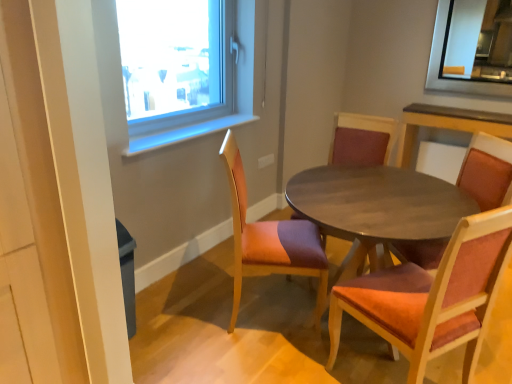
Describe the element at coordinates (361, 139) in the screenshot. The height and width of the screenshot is (384, 512). I see `wooden chair with red cushion at center, which appears as the 2th chair when viewed from the left` at that location.

What do you see at coordinates (270, 240) in the screenshot? This screenshot has width=512, height=384. I see `wooden textured chair at center, placed as the 4th chair when sorted from right to left` at bounding box center [270, 240].

What do you see at coordinates (371, 201) in the screenshot? Image resolution: width=512 pixels, height=384 pixels. I see `wooden table at center` at bounding box center [371, 201].

Where is `wooden chair with red cushion at center, placed as the third chair when sorted from right to left`? wooden chair with red cushion at center, placed as the third chair when sorted from right to left is located at coordinates (361, 139).

In terms of width, does wooden table at center look wider or thinner when compared to wooden textured chair at center, the 4th chair when ordered from left to right?

In the image, wooden table at center appears to be wider than wooden textured chair at center, the 4th chair when ordered from left to right.

The height and width of the screenshot is (384, 512). What are the coordinates of `kitchen & dining room table in front of the wooden textured chair at center, the 4th chair when ordered from left to right` in the screenshot? It's located at (371, 201).

Consider the image. From the image's perspective, is wooden table at center below wooden textured chair at center, the 4th chair when ordered from left to right?

Yes, from the image's perspective, wooden table at center is beneath wooden textured chair at center, the 4th chair when ordered from left to right.

Considering the relative sizes of wooden table at center and wooden textured chair at center, the 1th chair in the right-to-left sequence, in the image provided, is wooden table at center bigger than wooden textured chair at center, the 1th chair in the right-to-left sequence,?

Correct, wooden table at center is larger in size than wooden textured chair at center, the 1th chair in the right-to-left sequence.

Where is `the 3rd chair above the wooden table at center (from the image's perspective)`? This screenshot has width=512, height=384. the 3rd chair above the wooden table at center (from the image's perspective) is located at coordinates (361, 139).

Are wooden table at center and wooden chair with red cushion at center, placed as the third chair when sorted from right to left, making contact?

wooden table at center is not next to wooden chair with red cushion at center, placed as the third chair when sorted from right to left, and they're not touching.

Is wooden table at center wider than wooden chair with red cushion at center, placed as the third chair when sorted from right to left?

Yes, wooden table at center is wider than wooden chair with red cushion at center, placed as the third chair when sorted from right to left.

Between wooden table at center and wooden chair with red cushion at center, which appears as the 2th chair when viewed from the left, which one appears on the left side from the viewer's perspective?

wooden chair with red cushion at center, which appears as the 2th chair when viewed from the left.

What's the angular difference between velvet orange chair at center, the 3th chair positioned from the left, and wooden textured chair at center, the 1th chair in the right-to-left sequence,'s facing directions?

They differ by 72.6 degrees in their facing directions.

Considering the positions of objects velvet orange chair at center, the second chair positioned from the right, and wooden textured chair at center, the 4th chair when ordered from left to right, in the image provided, who is more to the right, velvet orange chair at center, the second chair positioned from the right, or wooden textured chair at center, the 4th chair when ordered from left to right,?

Positioned to the right is wooden textured chair at center, the 4th chair when ordered from left to right.

Can you confirm if velvet orange chair at center, the 3th chair positioned from the left, is wider than wooden textured chair at center, the 1th chair in the right-to-left sequence?

Correct, the width of velvet orange chair at center, the 3th chair positioned from the left, exceeds that of wooden textured chair at center, the 1th chair in the right-to-left sequence.

From the image's perspective, which is below, velvet orange chair at center, the 3th chair positioned from the left, or wooden textured chair at center, the 1th chair in the right-to-left sequence?

velvet orange chair at center, the 3th chair positioned from the left.

Is wooden chair with red cushion at center, placed as the third chair when sorted from right to left, aimed at wooden textured chair at center, placed as the 4th chair when sorted from right to left?

Yes, wooden chair with red cushion at center, placed as the third chair when sorted from right to left, is turned towards wooden textured chair at center, placed as the 4th chair when sorted from right to left.

Which of these two, wooden chair with red cushion at center, which appears as the 2th chair when viewed from the left, or wooden textured chair at center, acting as the first chair starting from the left, stands shorter?

wooden textured chair at center, acting as the first chair starting from the left, is shorter.

From the image's perspective, which is below, wooden chair with red cushion at center, which appears as the 2th chair when viewed from the left, or wooden textured chair at center, acting as the first chair starting from the left?

wooden textured chair at center, acting as the first chair starting from the left.

Is velvet orange chair at center, the 3th chair positioned from the left, surrounding wooden textured chair at center, placed as the 4th chair when sorted from right to left?

That's incorrect, wooden textured chair at center, placed as the 4th chair when sorted from right to left, is not inside velvet orange chair at center, the 3th chair positioned from the left.

From a real-world perspective, count 1st chairs upward from the velvet orange chair at center, the 3th chair positioned from the left, and point to it. Please provide its 2D coordinates.

[(270, 240)]

From a real-world perspective, who is located higher, velvet orange chair at center, the 3th chair positioned from the left, or wooden textured chair at center, placed as the 4th chair when sorted from right to left?

In real-world perspective, wooden textured chair at center, placed as the 4th chair when sorted from right to left, is above.

From the image's perspective, would you say velvet orange chair at center, the second chair positioned from the right, is positioned over wooden textured chair at center, acting as the first chair starting from the left?

Incorrect, from the image's perspective, velvet orange chair at center, the second chair positioned from the right, is lower than wooden textured chair at center, acting as the first chair starting from the left.

Could velvet orange chair at center, the second chair positioned from the right, be considered to be inside wooden table at center?

Yes, velvet orange chair at center, the second chair positioned from the right, can be found within wooden table at center.

Is point (387, 127) closer or farther from the camera than point (452, 239)?

Point (387, 127) appears to be farther away from the viewer than point (452, 239).

Does wooden table at center have a greater height compared to velvet orange chair at center, the 3th chair positioned from the left?

Incorrect, the height of wooden table at center is not larger of that of velvet orange chair at center, the 3th chair positioned from the left.

Between wooden table at center and velvet orange chair at center, the 3th chair positioned from the left, which one appears on the right side from the viewer's perspective?

velvet orange chair at center, the 3th chair positioned from the left.

From the image's perspective, relative to velvet orange chair at center, the second chair positioned from the right, is wooden chair with red cushion at center, placed as the third chair when sorted from right to left, above or below?

Based on their image positions, wooden chair with red cushion at center, placed as the third chair when sorted from right to left, is located above velvet orange chair at center, the second chair positioned from the right.

From a real-world perspective, does wooden chair with red cushion at center, which appears as the 2th chair when viewed from the left, stand above velvet orange chair at center, the second chair positioned from the right?

Yes, from a real-world perspective, wooden chair with red cushion at center, which appears as the 2th chair when viewed from the left, is on top of velvet orange chair at center, the second chair positioned from the right.

Is wooden chair with red cushion at center, placed as the third chair when sorted from right to left, bigger or smaller than velvet orange chair at center, the second chair positioned from the right?

Clearly, wooden chair with red cushion at center, placed as the third chair when sorted from right to left, is larger in size than velvet orange chair at center, the second chair positioned from the right.

Which is more to the left, wooden chair with red cushion at center, which appears as the 2th chair when viewed from the left, or velvet orange chair at center, the second chair positioned from the right?

wooden chair with red cushion at center, which appears as the 2th chair when viewed from the left, is more to the left.

Where is `kitchen & dining room table on the left of wooden textured chair at center, the 1th chair in the right-to-left sequence`? kitchen & dining room table on the left of wooden textured chair at center, the 1th chair in the right-to-left sequence is located at coordinates (371, 201).

Locate an element on the screen. The height and width of the screenshot is (384, 512). the 3rd chair behind when counting from the wooden table at center is located at coordinates (361, 139).

Which object lies nearer to the anchor point velvet orange chair at center, the 3th chair positioned from the left, wooden textured chair at center, the 1th chair in the right-to-left sequence, or wooden table at center?

Based on the image, wooden table at center appears to be nearer to velvet orange chair at center, the 3th chair positioned from the left.

Consider the image. Which object lies nearer to the anchor point wooden textured chair at center, the 4th chair when ordered from left to right, wooden textured chair at center, acting as the first chair starting from the left, or wooden table at center?

wooden table at center lies closer to wooden textured chair at center, the 4th chair when ordered from left to right, than the other object.

Considering their positions, is wooden table at center positioned further to wooden textured chair at center, placed as the 4th chair when sorted from right to left, than wooden textured chair at center, the 1th chair in the right-to-left sequence?

The object further to wooden textured chair at center, placed as the 4th chair when sorted from right to left, is wooden textured chair at center, the 1th chair in the right-to-left sequence.

Looking at the image, which one is located further to velvet orange chair at center, the 3th chair positioned from the left, wooden table at center or wooden textured chair at center, placed as the 4th chair when sorted from right to left?

wooden textured chair at center, placed as the 4th chair when sorted from right to left, is positioned further to the anchor velvet orange chair at center, the 3th chair positioned from the left.

Estimate the real-world distances between objects in this image. Which object is closer to wooden textured chair at center, placed as the 4th chair when sorted from right to left, wooden chair with red cushion at center, placed as the third chair when sorted from right to left, or wooden textured chair at center, the 4th chair when ordered from left to right?

The object closer to wooden textured chair at center, placed as the 4th chair when sorted from right to left, is wooden chair with red cushion at center, placed as the third chair when sorted from right to left.

Considering their positions, is wooden table at center positioned further to wooden textured chair at center, the 4th chair when ordered from left to right, than velvet orange chair at center, the second chair positioned from the right?

velvet orange chair at center, the second chair positioned from the right.

Which object lies further to the anchor point wooden textured chair at center, acting as the first chair starting from the left, wooden table at center or velvet orange chair at center, the second chair positioned from the right?

Based on the image, velvet orange chair at center, the second chair positioned from the right, appears to be further to wooden textured chair at center, acting as the first chair starting from the left.

Based on their spatial positions, is wooden table at center or wooden chair with red cushion at center, placed as the third chair when sorted from right to left, closer to wooden textured chair at center, the 1th chair in the right-to-left sequence?

wooden table at center.

At what (x,y) coordinates should I click in order to perform the action: click on kitchen & dining room table between wooden textured chair at center, acting as the first chair starting from the left, and velvet orange chair at center, the second chair positioned from the right, from left to right. Please return your answer as a coordinate pair (x, y). Image resolution: width=512 pixels, height=384 pixels. Looking at the image, I should click on (371, 201).

Find the location of a particular element. This screenshot has height=384, width=512. kitchen & dining room table positioned between velvet orange chair at center, the 3th chair positioned from the left, and wooden textured chair at center, the 4th chair when ordered from left to right, from near to far is located at coordinates (371, 201).

The image size is (512, 384). I want to click on kitchen & dining room table between velvet orange chair at center, the 3th chair positioned from the left, and wooden chair with red cushion at center, which appears as the 2th chair when viewed from the left, in the front-back direction, so click(371, 201).

Identify the location of kitchen & dining room table between wooden textured chair at center, acting as the first chair starting from the left, and wooden textured chair at center, the 4th chair when ordered from left to right, in the horizontal direction. The width and height of the screenshot is (512, 384). (371, 201).